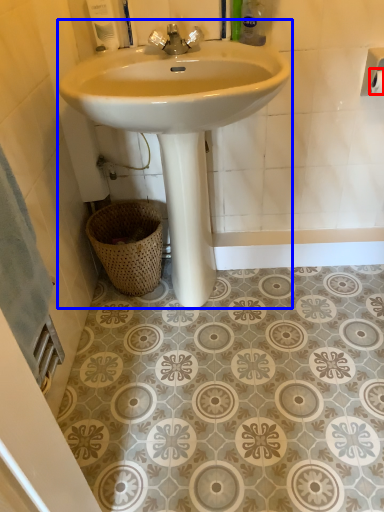
Question: Which object appears closest to the camera in this image, toilet paper (highlighted by a red box) or sink (highlighted by a blue box)?

Choices:
 (A) toilet paper
 (B) sink

Answer: (B)